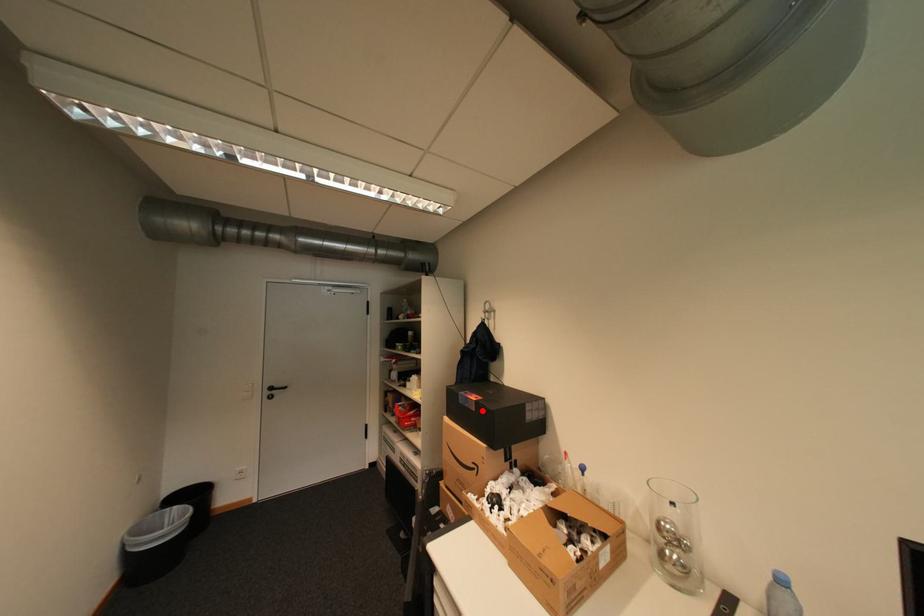
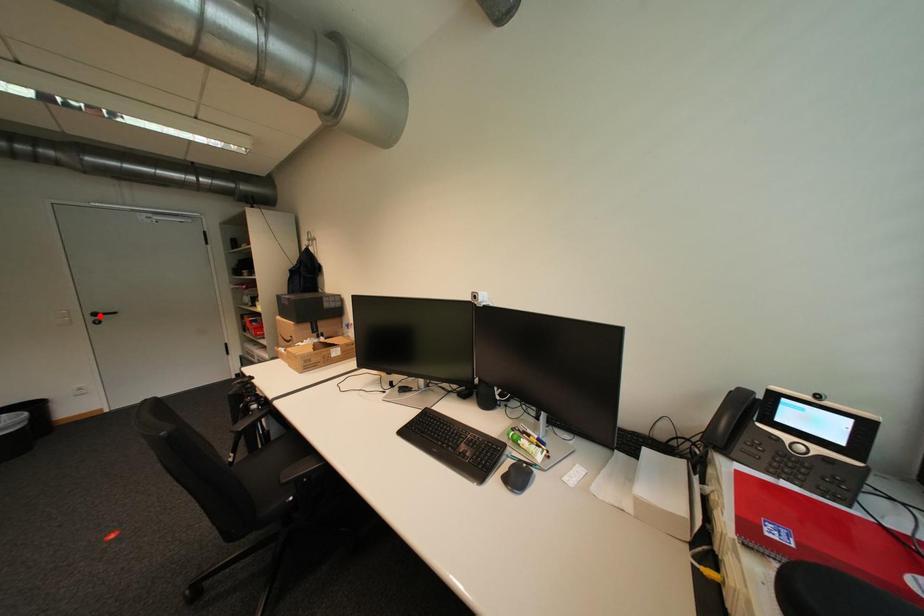
I am providing you with two images of the same scene from different viewpoints. A red point is marked on the first image and another point is marked on the second image. Does the point marked in image1 correspond to the same location as the one in image2?

No